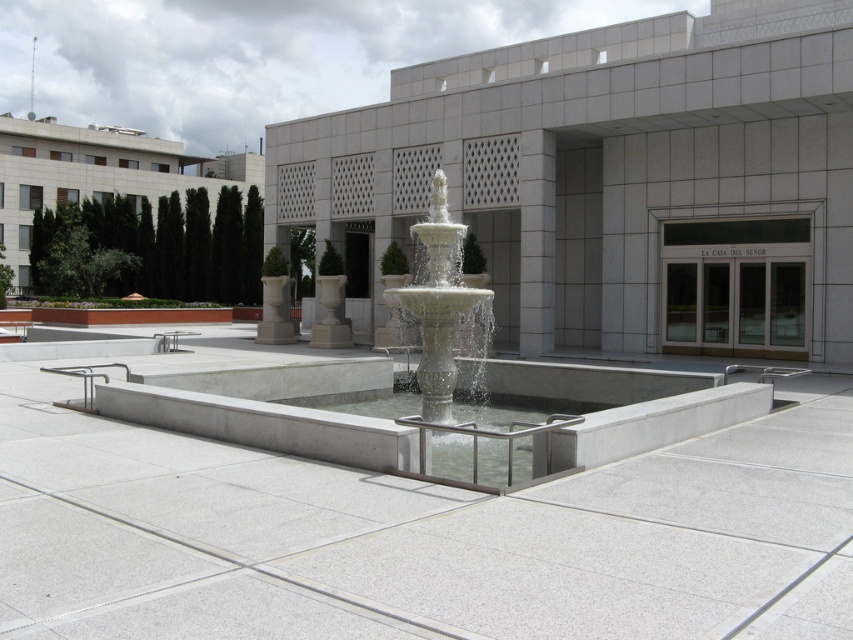
You are a visitor standing at the entrance of the building. You want to take a photo of the white concrete fountain at center without any obstructions. Is the white smooth pillar at center blocking your view of the fountain?

The white concrete fountain at center is positioned under the white smooth pillar at center, so the pillar is blocking the view of the fountain from the entrance. You will not be able to take a clear photo without the pillar obstructing the fountain.

You are a visitor standing at the entrance of the building. You want to walk towards the white marble fountain at center but need to pass by the white smooth pillar at center. Based on their sizes, will you have enough space to walk between them?

The white marble fountain at center might be wider than the white smooth pillar at center, so there may not be enough space to walk between them safely. It is recommended to choose a different path or check the actual dimensions before proceeding.